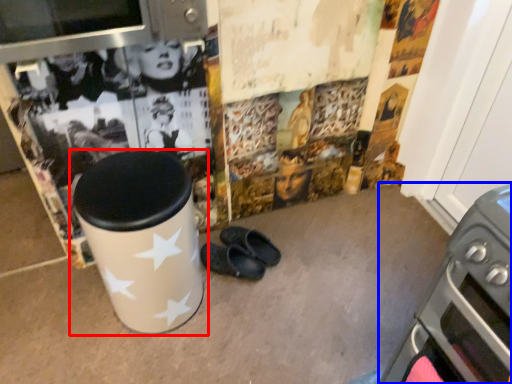
Question: Which of the following is the farthest to the observer, waste container (highlighted by a red box) or home appliance (highlighted by a blue box)?

Choices:
 (A) waste container
 (B) home appliance

Answer: (A)